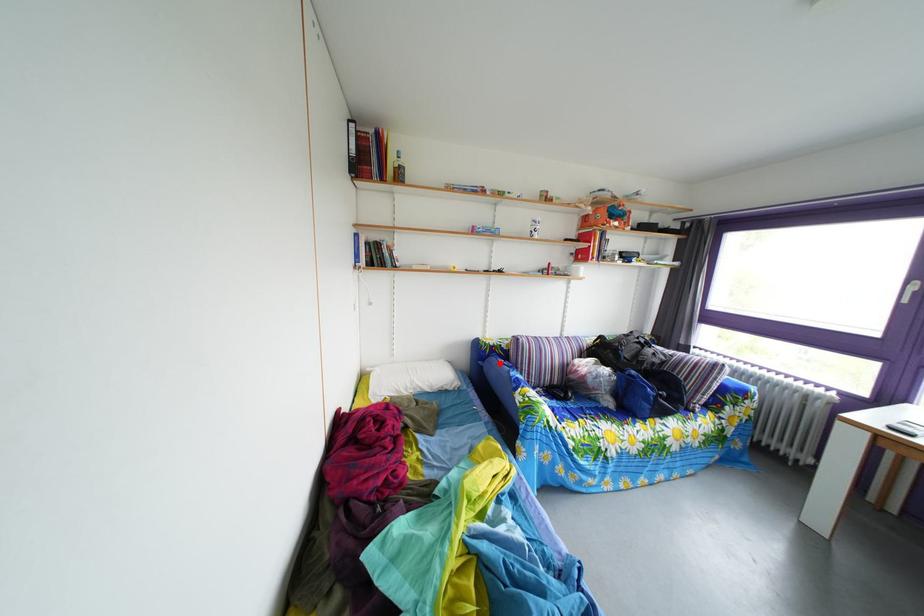
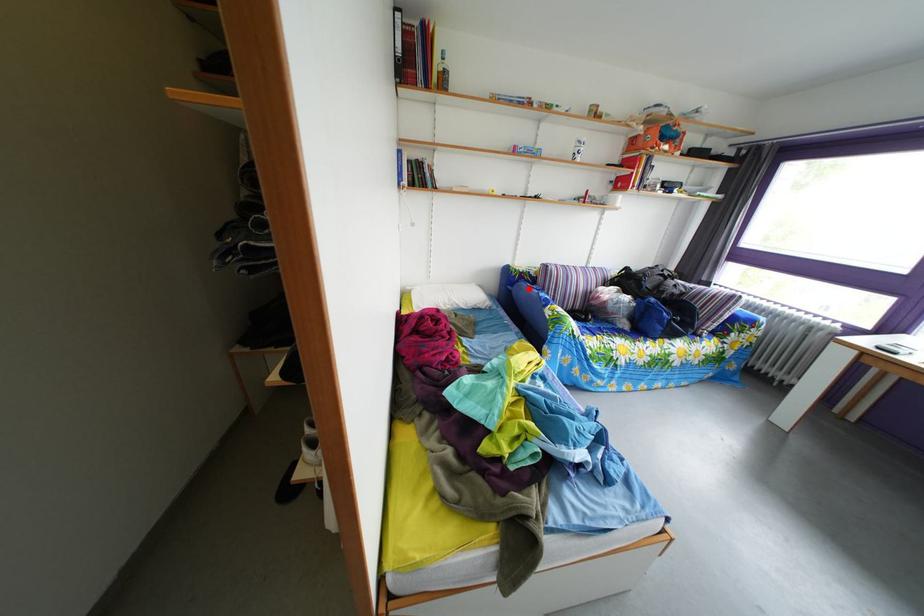
I am providing you with two images of the same scene from different viewpoints. A red point is marked on the first image and another point is marked on the second image. Is the marked point in image1 the same physical position as the marked point in image2?

Yes